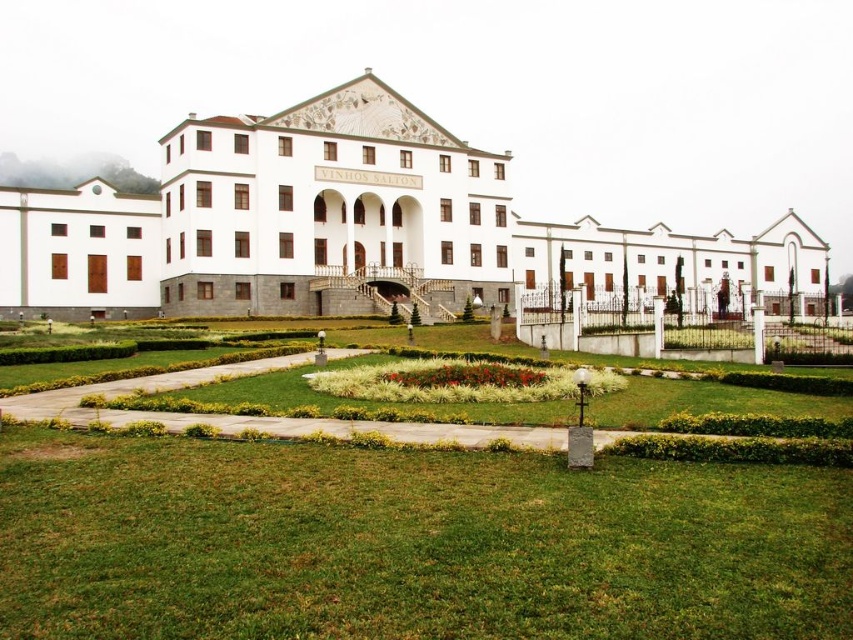
Question: Does green grass at center lie in front of white stone building at center?

Choices:
 (A) yes
 (B) no

Answer: (A)

Question: Can you confirm if green grass at center is bigger than white stone building at center?

Choices:
 (A) yes
 (B) no

Answer: (B)

Question: Which of the following is the closest to the observer?

Choices:
 (A) white stone building at center
 (B) green grass at center

Answer: (B)

Question: Which of the following is the closest to the observer?

Choices:
 (A) white stone building at center
 (B) green grass at center

Answer: (B)

Question: Where is green grass at center located in relation to white stone building at center in the image?

Choices:
 (A) below
 (B) above

Answer: (A)